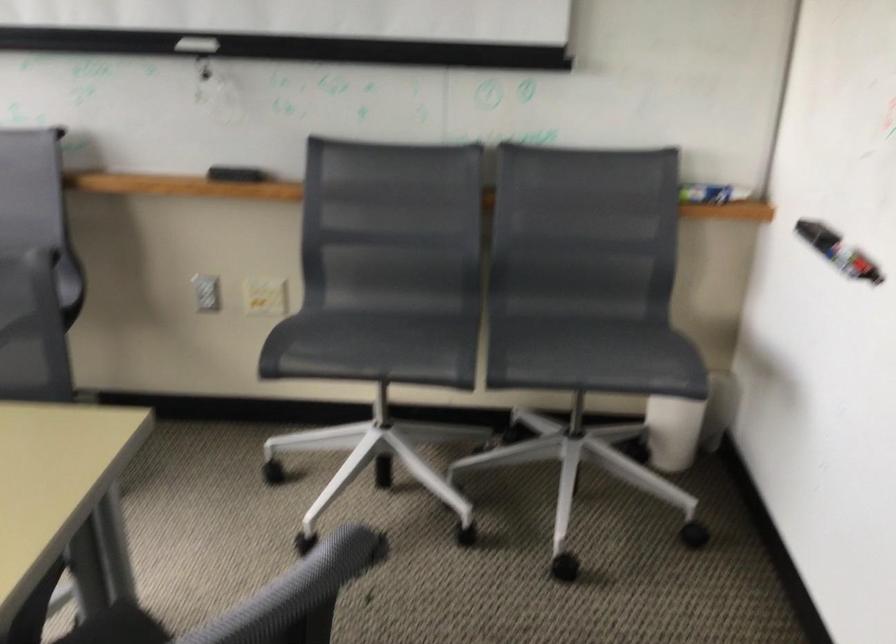
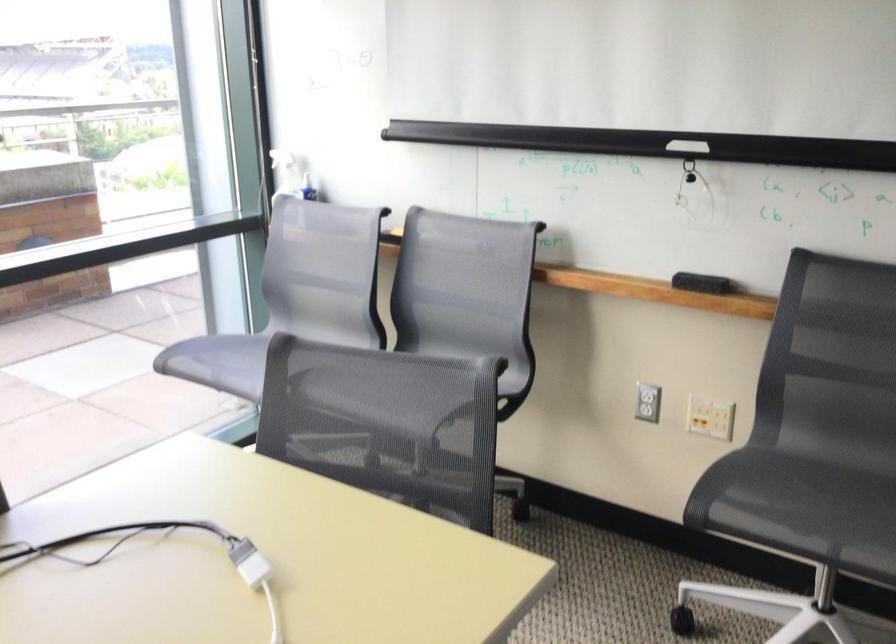
Locate, in the second image, the point that corresponds to (352,335) in the first image.

(782, 494)